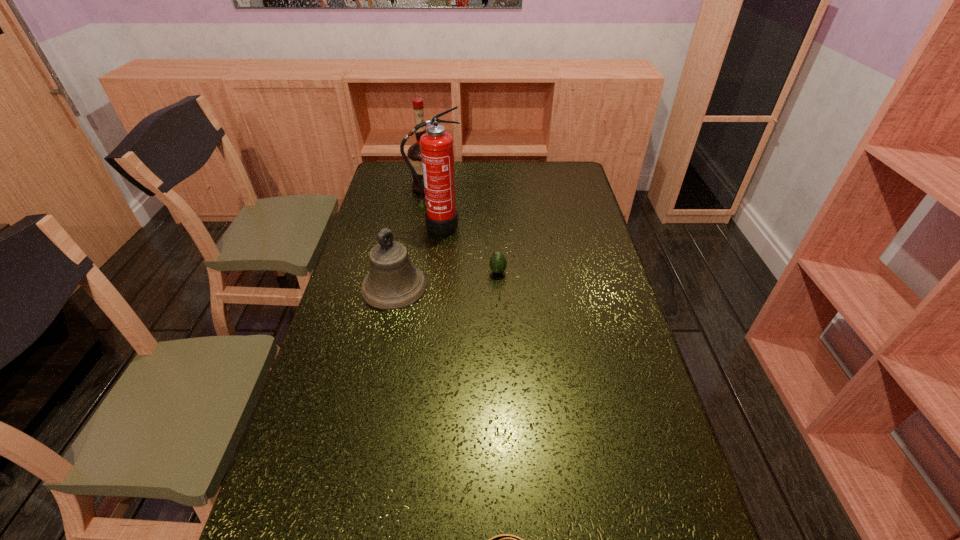
This screenshot has height=540, width=960. I want to click on the tallest object, so click(x=437, y=153).

Find the location of `fire extinguisher`. fire extinguisher is located at coordinates (437, 153).

Locate an element on the screen. the farthest object is located at coordinates (414, 152).

Where is `liquor`? liquor is located at coordinates (414, 152).

At what (x,y) coordinates should I click in order to perform the action: click on bell. Please return your answer as a coordinate pair (x, y). Looking at the image, I should click on (393, 282).

What are the coordinates of `avocado` in the screenshot? It's located at (497, 263).

At what (x,y) coordinates should I click in order to perform the action: click on free spot located 0.230m on the front-facing side of the fire extinguisher. Please return your answer as a coordinate pair (x, y). Looking at the image, I should click on (430, 278).

Locate an element on the screen. The height and width of the screenshot is (540, 960). vacant space located on the front and back of the liquor is located at coordinates (522, 188).

You are a GUI agent. You are given a task and a screenshot of the screen. Output one action in this format:
    pyautogui.click(x=<x>, y=<y>)
    Task: Click on the vacant space located 0.400m on the front of the third tallest object
    The height and width of the screenshot is (540, 960).
    Given the screenshot: What is the action you would take?
    pyautogui.click(x=364, y=431)

The height and width of the screenshot is (540, 960). I want to click on vacant space located 0.240m on the right of the avocado, so click(578, 272).